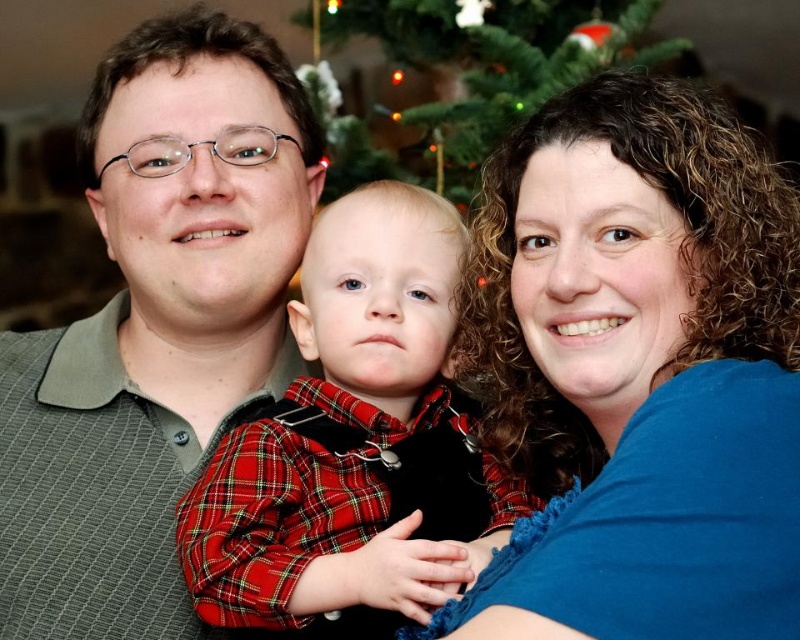
Question: Which object appears farthest from the camera in this image?

Choices:
 (A) green textured christmas tree at upper center
 (B) matte gray shirt at left
 (C) blue fabric at upper right
 (D) red plaid shirt at center

Answer: (A)

Question: Among these objects, which one is nearest to the camera?

Choices:
 (A) matte gray shirt at left
 (B) red plaid shirt at center
 (C) blue fabric at upper right

Answer: (C)

Question: Is blue fabric at upper right wider than green textured christmas tree at upper center?

Choices:
 (A) no
 (B) yes

Answer: (A)

Question: Can you confirm if blue fabric at upper right is thinner than matte gray shirt at left?

Choices:
 (A) no
 (B) yes

Answer: (B)

Question: Is matte gray shirt at left bigger than green textured christmas tree at upper center?

Choices:
 (A) yes
 (B) no

Answer: (B)

Question: Which point appears closest to the camera in this image?

Choices:
 (A) (336, 605)
 (B) (614, 38)

Answer: (A)